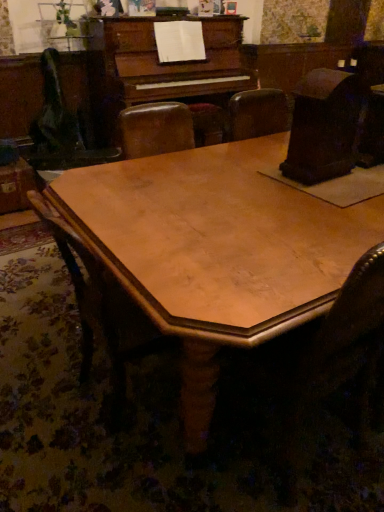
Question: Visually, is wooden table at center positioned to the left or to the right of wooden chair at center?

Choices:
 (A) right
 (B) left

Answer: (A)

Question: Do you think wooden table at center is within wooden chair at center, or outside of it?

Choices:
 (A) inside
 (B) outside

Answer: (B)

Question: Looking at their shapes, would you say wooden table at center is wider or thinner than wooden chair at center?

Choices:
 (A) wide
 (B) thin

Answer: (A)

Question: Considering the relative positions of wooden chair at center and wooden table at center in the image provided, is wooden chair at center to the left or to the right of wooden table at center?

Choices:
 (A) right
 (B) left

Answer: (B)

Question: In terms of size, does wooden chair at center appear bigger or smaller than wooden table at center?

Choices:
 (A) small
 (B) big

Answer: (A)

Question: Relative to wooden table at center, is wooden chair at center in front or behind?

Choices:
 (A) behind
 (B) front

Answer: (A)

Question: Would you say wooden chair at center is inside or outside wooden table at center?

Choices:
 (A) outside
 (B) inside

Answer: (B)